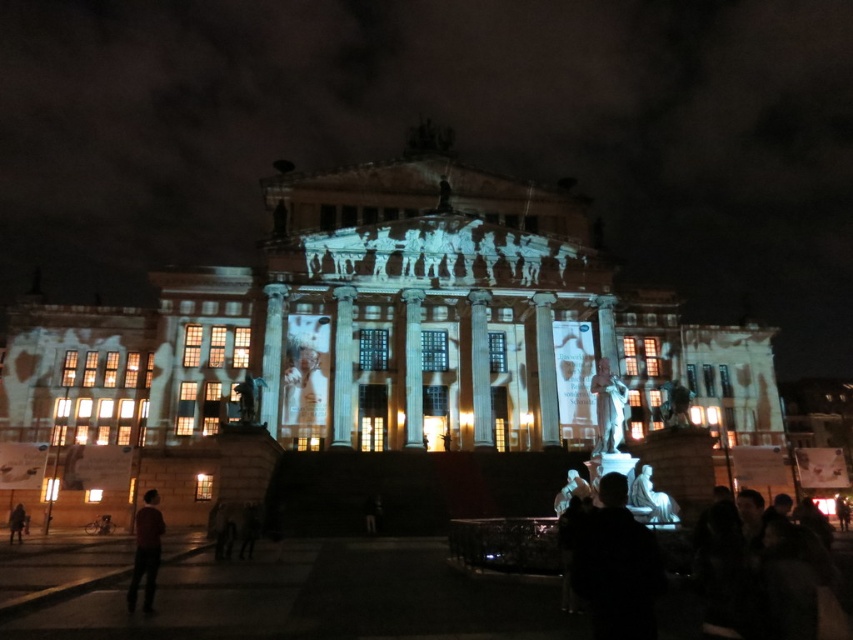
Who is taller, black matte statue at lower center or dark brown leather jacket at lower left?

black matte statue at lower center is taller.

Is point (575, 554) in front of point (20, 513)?

Yes, it is in front of point (20, 513).

Is point (605, 621) less distant than point (10, 536)?

Yes, point (605, 621) is in front of point (10, 536).

This screenshot has width=853, height=640. I want to click on black matte statue at lower center, so click(x=616, y=564).

Is black matte statue at lower center shorter than dark red sweater at lower left?

Indeed, black matte statue at lower center has a lesser height compared to dark red sweater at lower left.

Which is in front, point (601, 486) or point (144, 592)?

Point (601, 486)

Identify the location of black matte statue at lower center. (616, 564).

Does polished bronze statue at center have a larger size compared to white marble statue at center?

Yes, polished bronze statue at center is bigger than white marble statue at center.

Looking at this image, can you confirm if polished bronze statue at center is shorter than white marble statue at center?

No, polished bronze statue at center is not shorter than white marble statue at center.

The image size is (853, 640). What are the coordinates of `polished bronze statue at center` in the screenshot? It's located at (608, 408).